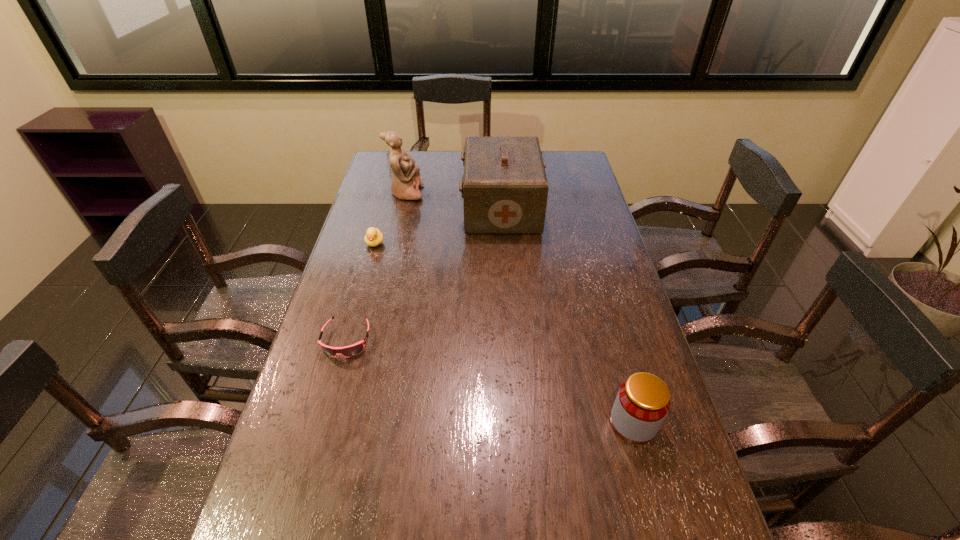
This screenshot has height=540, width=960. Find the location of `free point that satisfies the following two spatial constraints: 1. on the front-facing side of the figurine; 2. on the left side of the nearest object`. free point that satisfies the following two spatial constraints: 1. on the front-facing side of the figurine; 2. on the left side of the nearest object is located at coordinates (354, 423).

Where is `vacant region that satisfies the following two spatial constraints: 1. on the front-facing side of the figurine; 2. on the beak of the second shortest object`? vacant region that satisfies the following two spatial constraints: 1. on the front-facing side of the figurine; 2. on the beak of the second shortest object is located at coordinates (395, 243).

Where is `free spot that satisfies the following two spatial constraints: 1. on the front-facing side of the nearest object; 2. on the right side of the figurine`? free spot that satisfies the following two spatial constraints: 1. on the front-facing side of the nearest object; 2. on the right side of the figurine is located at coordinates (354, 423).